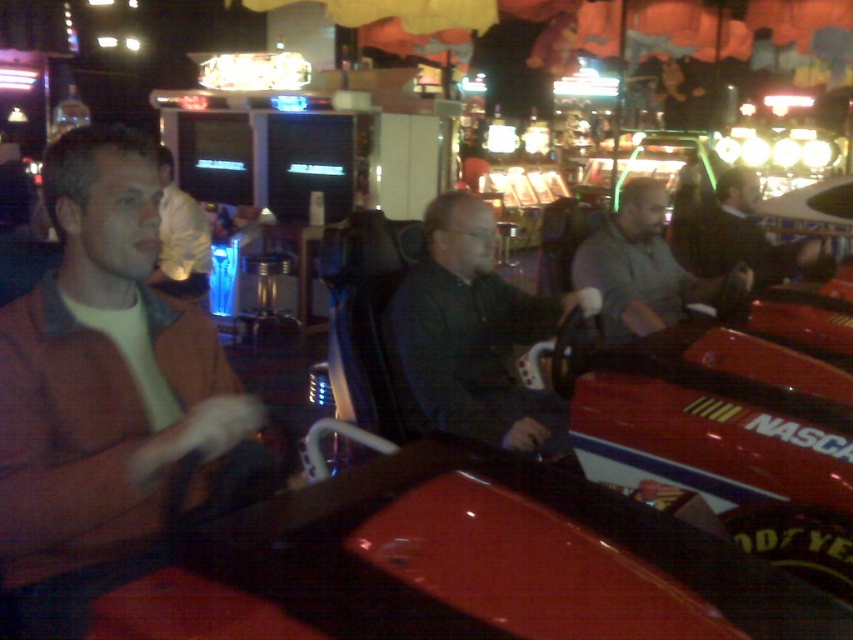
In the arcade scene, there are two people wearing the matte brown jacket at left and the white shirt at center. From the perspective of someone standing in front of the arcade machines, which one is positioned more to the left?

The white shirt at center is more to the left because the matte brown jacket at left is to the right of it.

You are standing in the arcade and want to place a new machine between the two points, point (550, 445) and point (630, 333). Which point should the machine be closer to in order to be nearer to the front of the arcade?

The machine should be placed closer to point (550, 445) because it is closer to the viewer than point (630, 333).

You are a game attendant in the arcade. You need to check the status of the person wearing the matte brown jacket at left and the white shirt at center. From your vantage point, which person is positioned lower in the scene?

The matte brown jacket at left is located below the white shirt at center, so the person wearing the matte brown jacket at left is positioned lower in the scene.